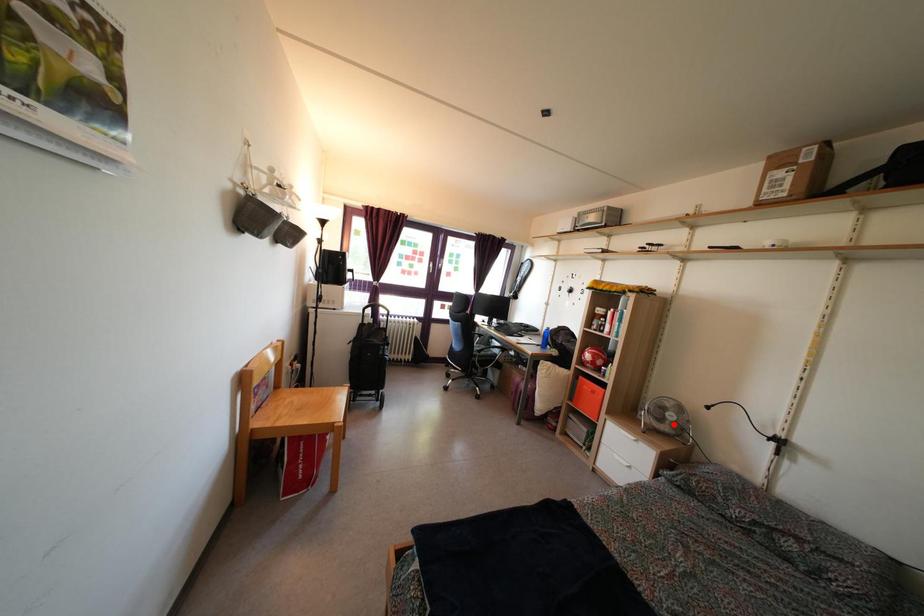
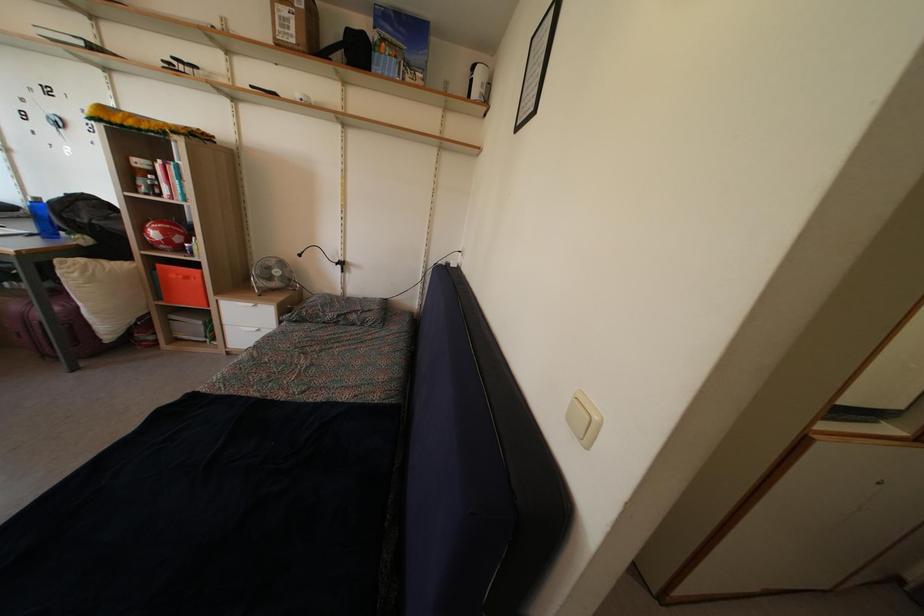
Question: I am providing you with two images of the same scene from different viewpoints. Given a red point in image1, look at the same physical point in image2. Is it:

Choices:
 (A) Closer to the viewpoint
 (B) Farther from the viewpoint

Answer: (A)